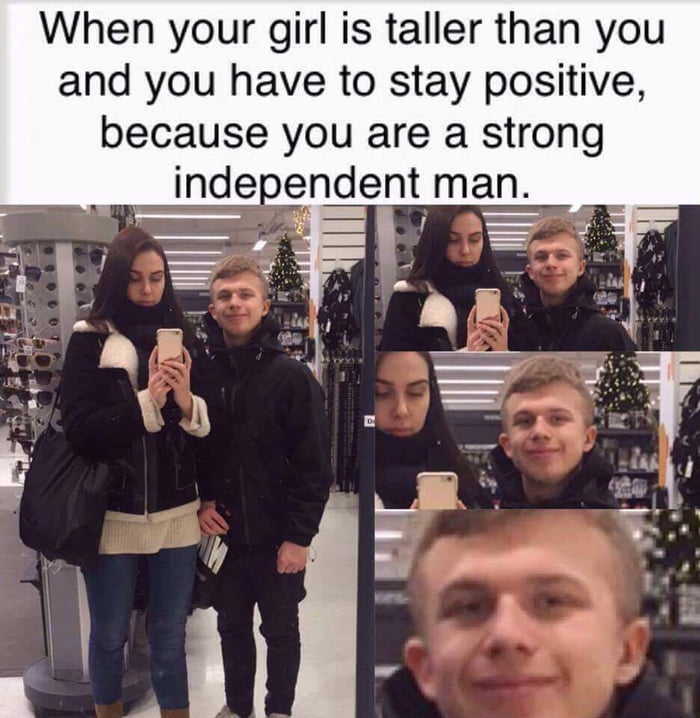
Find the location of a particular element. The width and height of the screenshot is (700, 718). tile flooring is located at coordinates (342, 658).